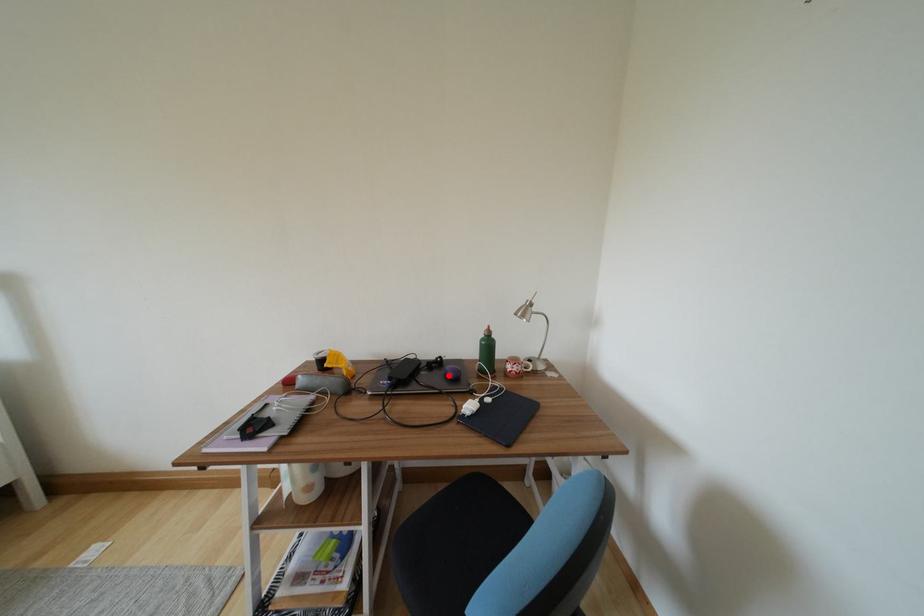
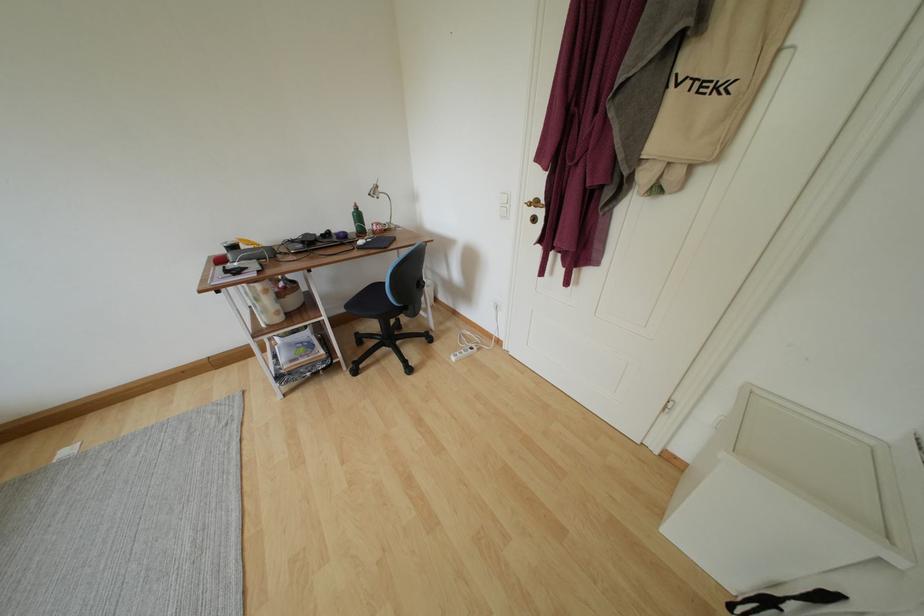
Locate, in the second image, the point that corresponds to the highlighted location in the first image.

(339, 241)